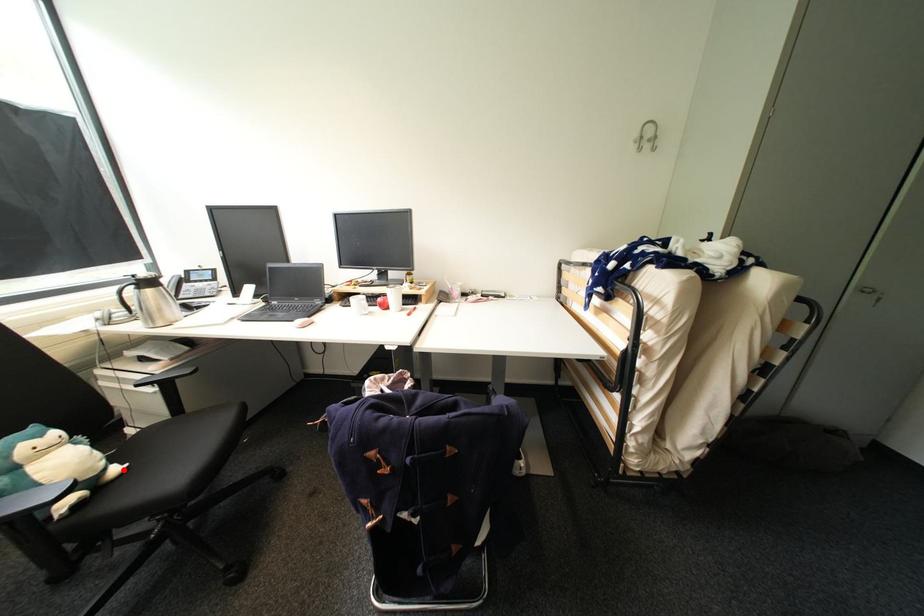
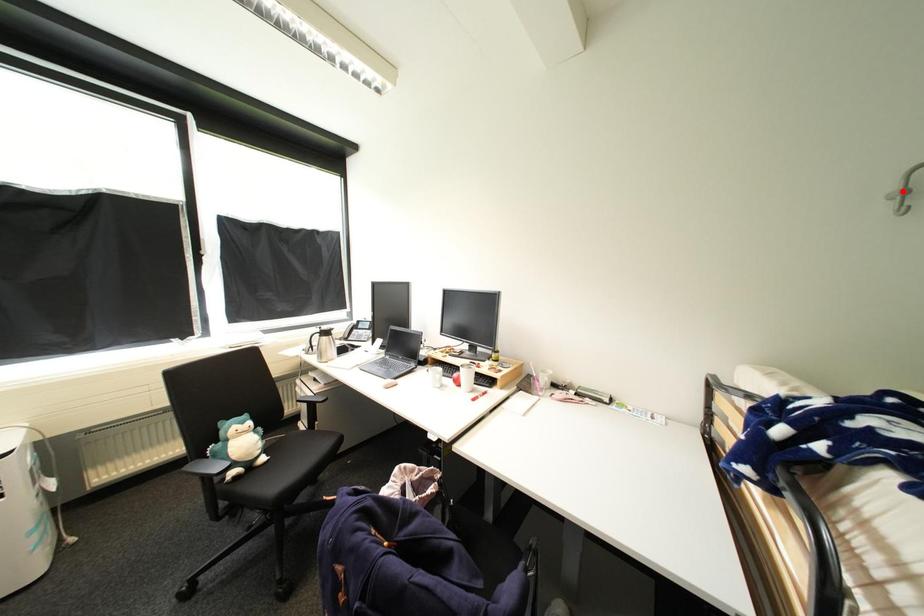
I am providing you with two images of the same scene from different viewpoints. A red point is marked on the first image and another point is marked on the second image. Are the points marked in image1 and image2 representing the same 3D position?

No